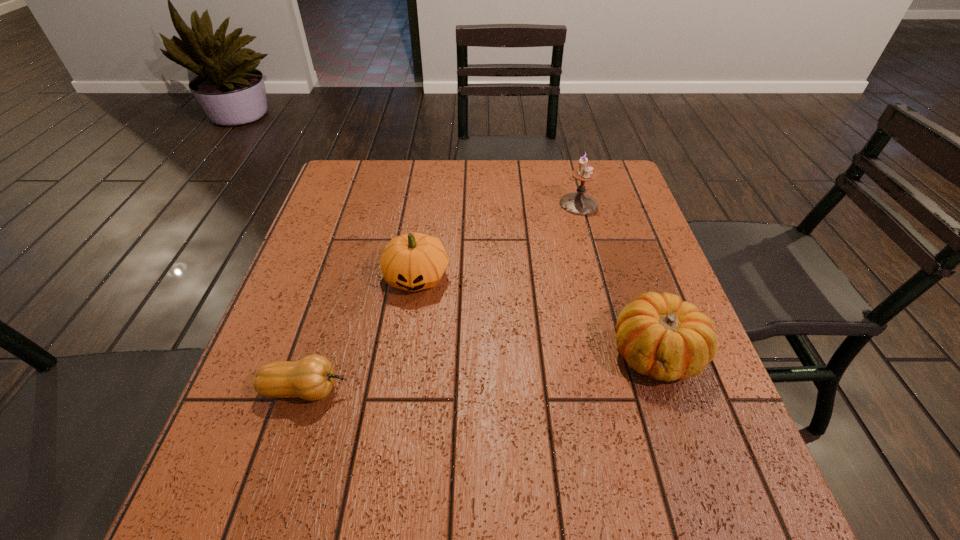
You are a GUI agent. You are given a task and a screenshot of the screen. Output one action in this format:
    pyautogui.click(x=<x>, y=<y>)
    Task: Click on the free space located 0.250m on the stem side of the leftmost gourd
    
    Given the screenshot: What is the action you would take?
    pyautogui.click(x=477, y=390)

Image resolution: width=960 pixels, height=540 pixels. I want to click on object located in the far edge section of the desktop, so click(x=578, y=203).

Image resolution: width=960 pixels, height=540 pixels. Find the location of `object located at the left edge`. object located at the left edge is located at coordinates (311, 378).

This screenshot has height=540, width=960. I want to click on candle holder at the right edge, so click(x=578, y=203).

At what (x,y) coordinates should I click in order to perform the action: click on gourd situated at the right edge. Please return your answer as a coordinate pair (x, y). Looking at the image, I should click on (659, 335).

At what (x,y) coordinates should I click in order to perform the action: click on object located in the far right corner section of the desktop. Please return your answer as a coordinate pair (x, y). Looking at the image, I should click on (578, 203).

Image resolution: width=960 pixels, height=540 pixels. In order to click on vacant point at the far edge in this screenshot , I will do pos(482,195).

Find the location of a particular element. vacant region at the left edge of the desktop is located at coordinates (229, 465).

What are the coordinates of `vacant space at the right edge` in the screenshot? It's located at (703, 426).

In the image, there is a desktop. At what (x,y) coordinates should I click in order to perform the action: click on free space at the far left corner. Please return your answer as a coordinate pair (x, y). This screenshot has height=540, width=960. Looking at the image, I should click on (382, 160).